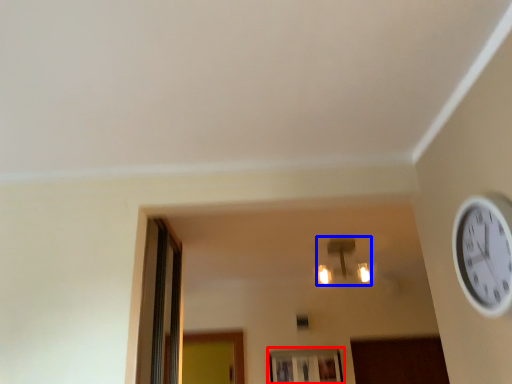
Question: Which object appears farthest to the camera in this image, window (highlighted by a red box) or light fixture (highlighted by a blue box)?

Choices:
 (A) window
 (B) light fixture

Answer: (A)